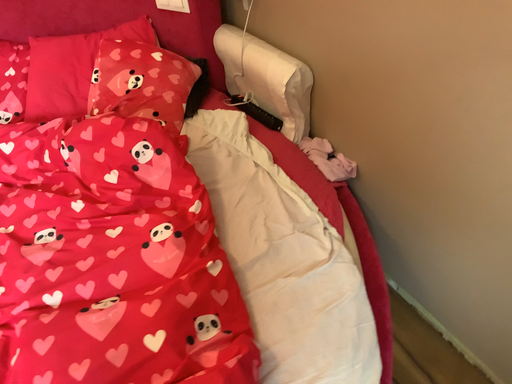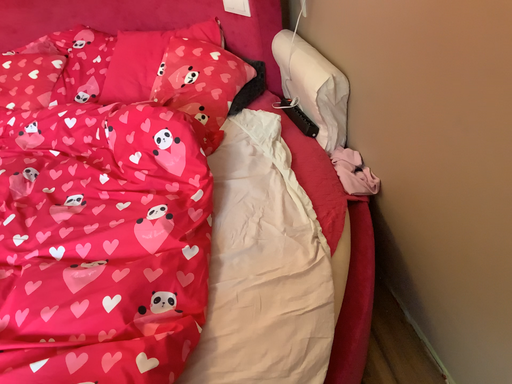
Question: Which way did the camera rotate in the video?

Choices:
 (A) rotated left
 (B) rotated right

Answer: (A)